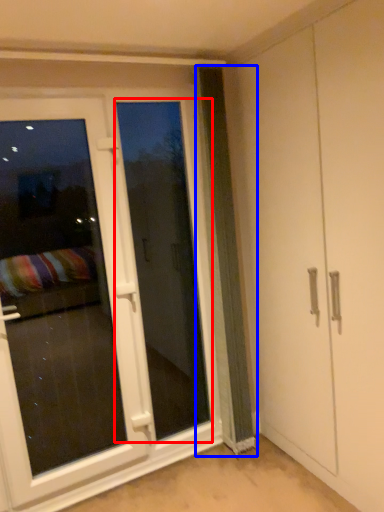
Question: Which point is closer to the camera, screen door (highlighted by a red box) or curtain (highlighted by a blue box)?

Choices:
 (A) screen door
 (B) curtain

Answer: (B)